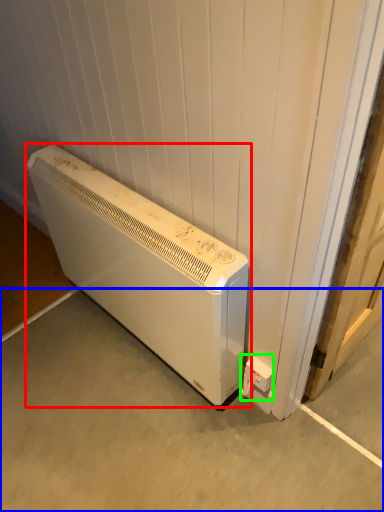
Question: Which is farther away from home appliance (highlighted by a red box)? concrete (highlighted by a blue box) or electric outlet (highlighted by a green box)?

Choices:
 (A) concrete
 (B) electric outlet

Answer: (B)